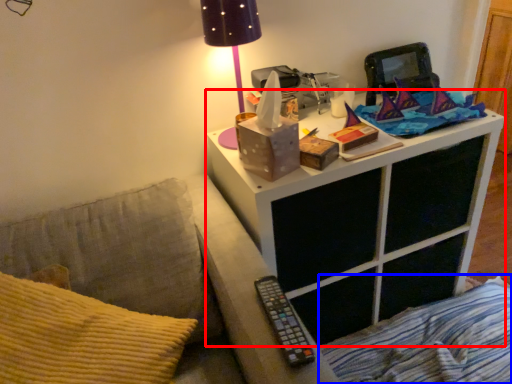
Question: Among these objects, which one is nearest to the camera, nightstand (highlighted by a red box) or bedding (highlighted by a blue box)?

Choices:
 (A) nightstand
 (B) bedding

Answer: (A)